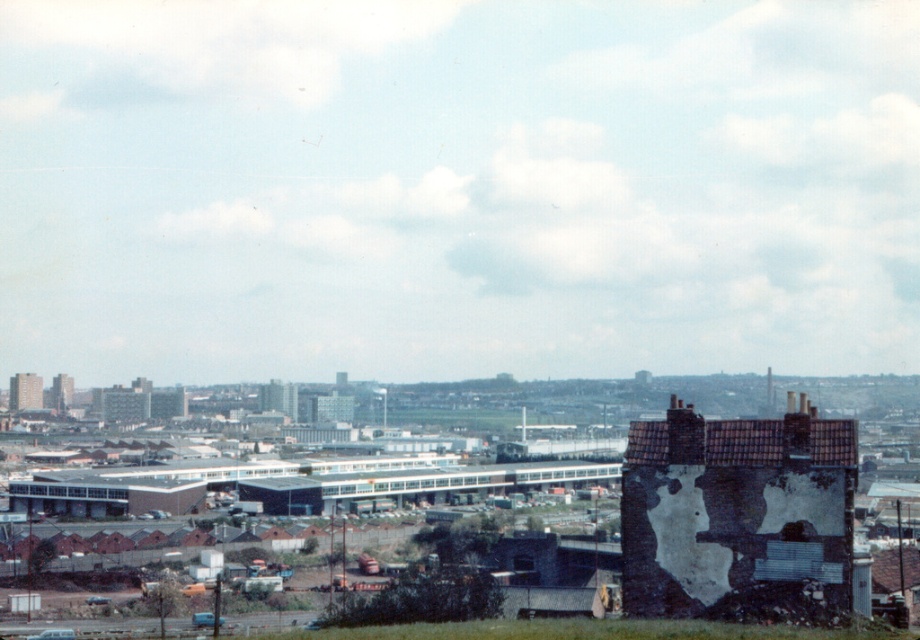
Consider the image. You are standing in the urban landscape scene. There is a point marked at coordinates point (805, 548). If you want to reach this point, will you have to walk more than 200 feet?

The point (805, 548) is 220.23 feet away from the viewer, so yes, you will have to walk more than 200 feet to reach it.

You are a photographer positioned in the urban landscape scene. You want to capture a photo that includes both the white plastered wall at center and the brick tower at upper left. Which object will appear larger in your photo?

The white plastered wall at center will appear larger in the photo because it is closer to the viewer than the brick tower at upper left.

You are standing in the urban landscape shown in the image. You notice two points marked in the scene. The first point is at coordinate point (791, 444) and the second is at point (69, 378). Which of these two points is closer to your current position?

Point (791, 444) is closer to the viewer than point (69, 378).